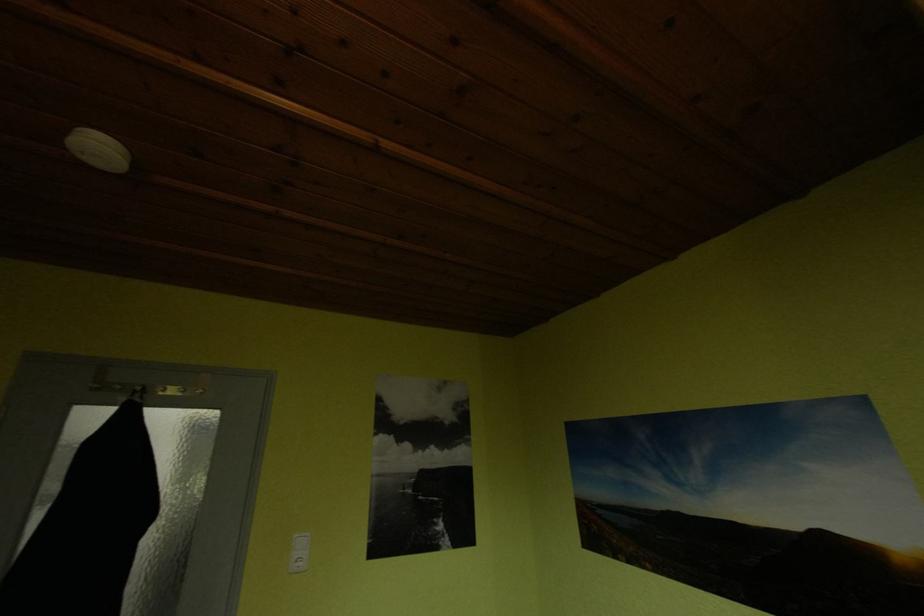
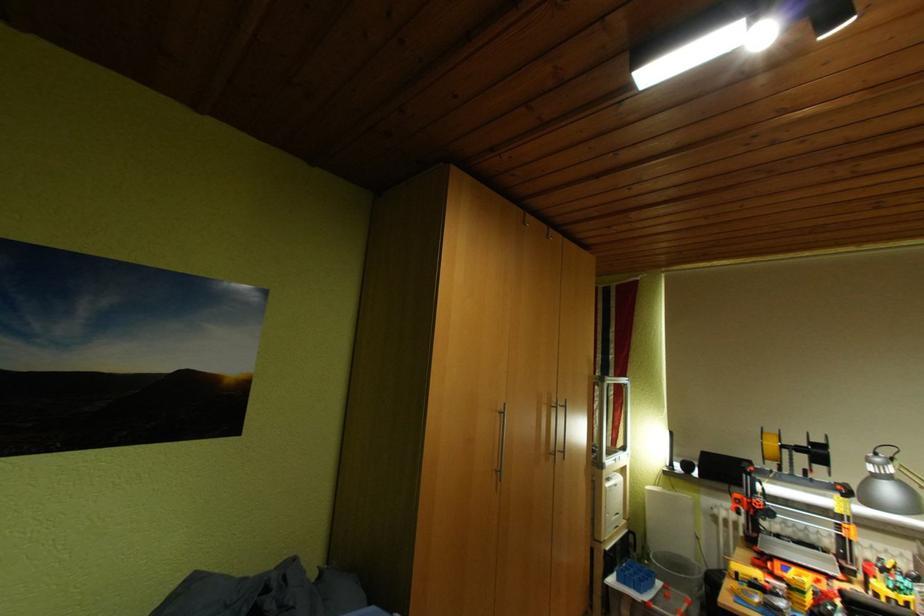
First-person continuous shooting, in which direction is the camera rotating?

The camera rotated toward right-up.